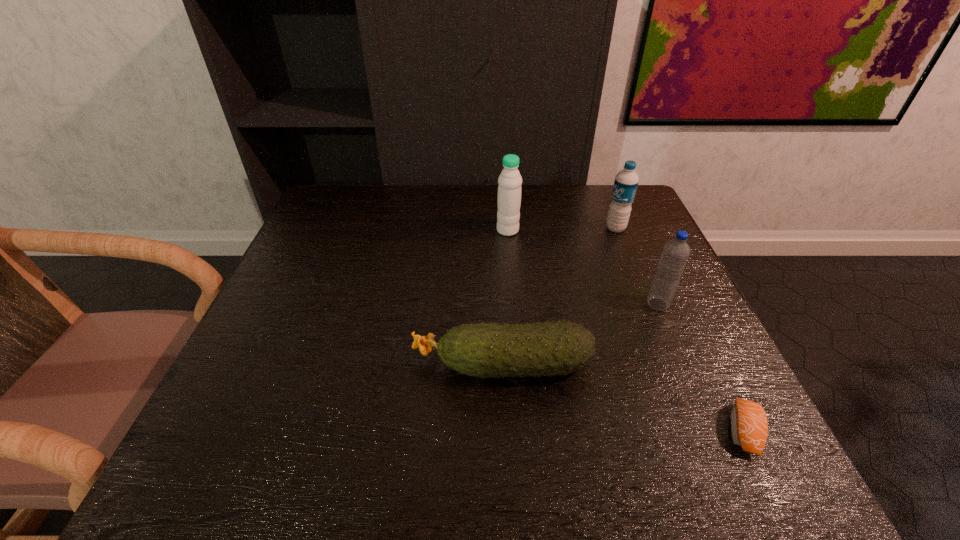
Where is `vacant space located at the blossom end of the fourth farthest object`? vacant space located at the blossom end of the fourth farthest object is located at coordinates coord(371,364).

Image resolution: width=960 pixels, height=540 pixels. Identify the location of vacant area located 0.310m on the left of the shortest object. (541, 431).

At what (x,y) coordinates should I click in order to perform the action: click on object that is at the near edge. Please return your answer as a coordinate pair (x, y). The width and height of the screenshot is (960, 540). Looking at the image, I should click on (749, 428).

The height and width of the screenshot is (540, 960). I want to click on sushi that is at the right edge, so click(x=749, y=428).

I want to click on object that is positioned at the far right corner, so click(626, 181).

What are the coordinates of `object present at the near right corner` in the screenshot? It's located at (749, 428).

This screenshot has height=540, width=960. Identify the location of vacant space at the far edge of the desktop. (433, 188).

Where is `vacant space at the near edge of the desktop`? The image size is (960, 540). vacant space at the near edge of the desktop is located at coordinates point(504,449).

This screenshot has width=960, height=540. Find the location of `vacant space at the left edge of the desktop`. vacant space at the left edge of the desktop is located at coordinates (344, 268).

The height and width of the screenshot is (540, 960). What are the coordinates of `vacant area at the right edge` in the screenshot? It's located at (672, 406).